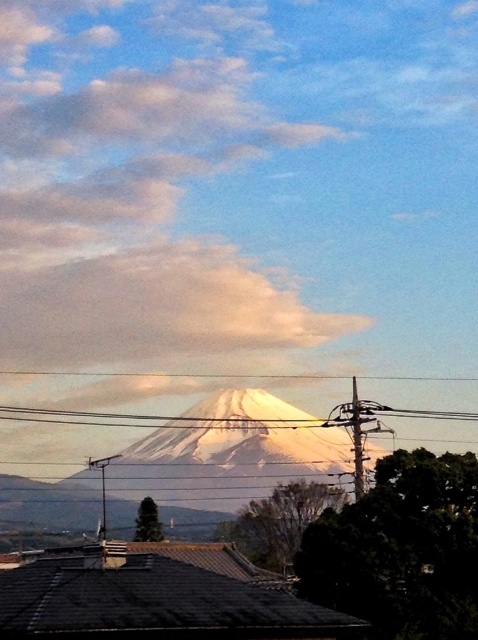
Consider the image. Between white fluffy cloud at upper center and white snow-covered mountain at center, which one has more height?

white fluffy cloud at upper center

Can you confirm if white fluffy cloud at upper center is bigger than white snow-covered mountain at center?

No, white fluffy cloud at upper center is not bigger than white snow-covered mountain at center.

Locate an element on the screen. The height and width of the screenshot is (640, 478). white fluffy cloud at upper center is located at coordinates (158, 308).